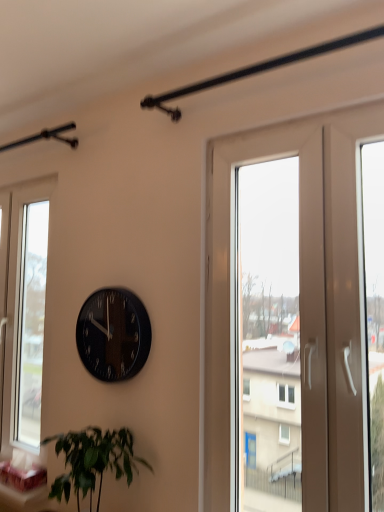
Question: Should I look upward or downward to see white glossy screen door at right?

Choices:
 (A) up
 (B) down

Answer: (B)

Question: Is the depth of transparent glass window at left greater than that of black glossy clock at center?

Choices:
 (A) no
 (B) yes

Answer: (B)

Question: Is black glossy clock at center a part of transparent glass window at left?

Choices:
 (A) yes
 (B) no

Answer: (B)

Question: From the image's perspective, would you say transparent glass window at left is shown under black glossy clock at center?

Choices:
 (A) yes
 (B) no

Answer: (A)

Question: From the image's perspective, is transparent glass window at left above black glossy clock at center?

Choices:
 (A) yes
 (B) no

Answer: (B)

Question: From a real-world perspective, is transparent glass window at left below black glossy clock at center?

Choices:
 (A) yes
 (B) no

Answer: (B)

Question: Is transparent glass window at left positioned beyond the bounds of black glossy clock at center?

Choices:
 (A) yes
 (B) no

Answer: (A)

Question: Can you confirm if green leafy plant at lower left is positioned to the right of black glossy clock at center?

Choices:
 (A) no
 (B) yes

Answer: (A)

Question: Does green leafy plant at lower left have a lesser width compared to black glossy clock at center?

Choices:
 (A) yes
 (B) no

Answer: (B)

Question: Considering the relative sizes of green leafy plant at lower left and black glossy clock at center in the image provided, is green leafy plant at lower left shorter than black glossy clock at center?

Choices:
 (A) no
 (B) yes

Answer: (B)

Question: Is green leafy plant at lower left positioned behind black glossy clock at center?

Choices:
 (A) yes
 (B) no

Answer: (B)

Question: From the image's perspective, is green leafy plant at lower left on black glossy clock at center?

Choices:
 (A) yes
 (B) no

Answer: (B)

Question: Is green leafy plant at lower left facing towards black glossy clock at center?

Choices:
 (A) no
 (B) yes

Answer: (A)

Question: From the image's perspective, is transparent glass window at left located beneath green leafy plant at lower left?

Choices:
 (A) no
 (B) yes

Answer: (A)